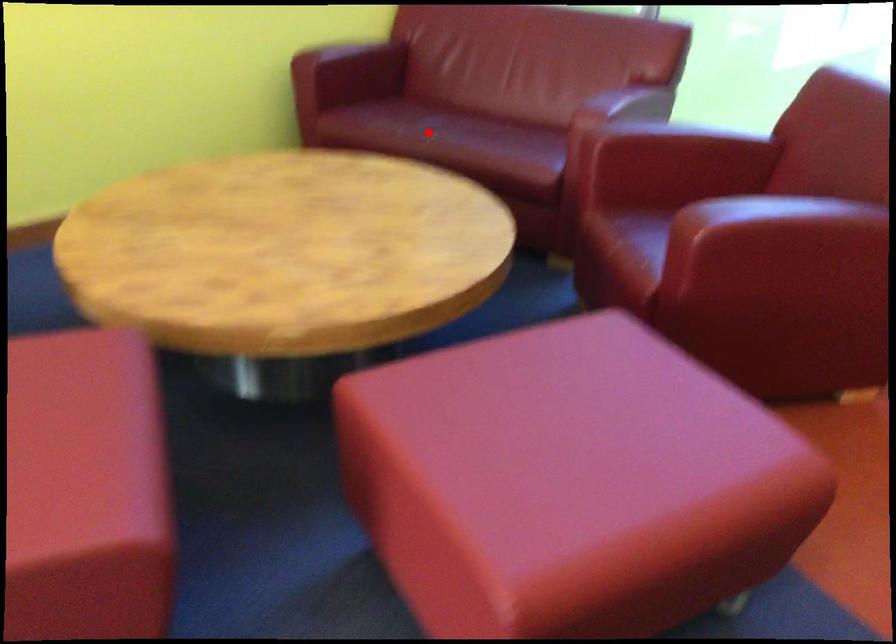
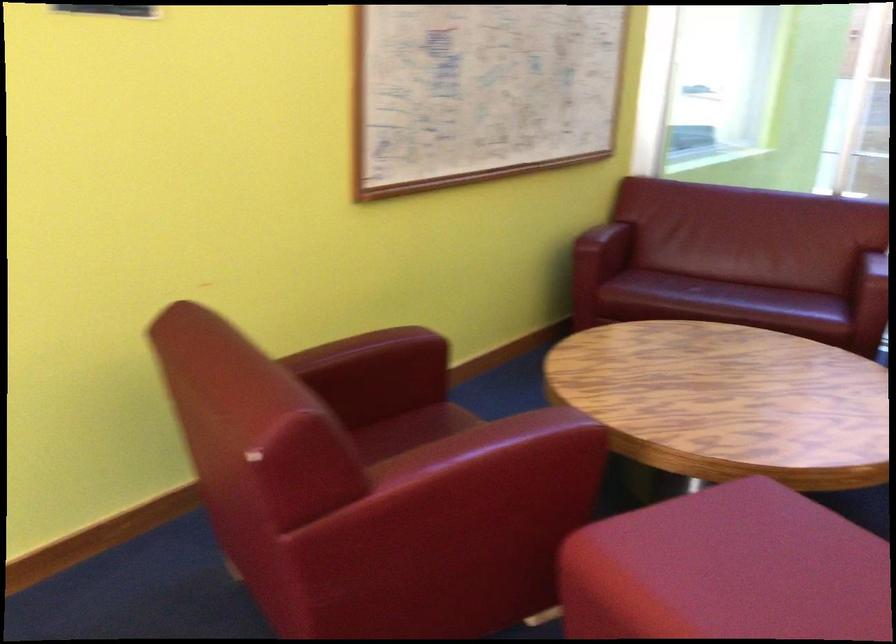
Where in the second image is the point corresponding to the highlighted location from the first image?

(719, 297)